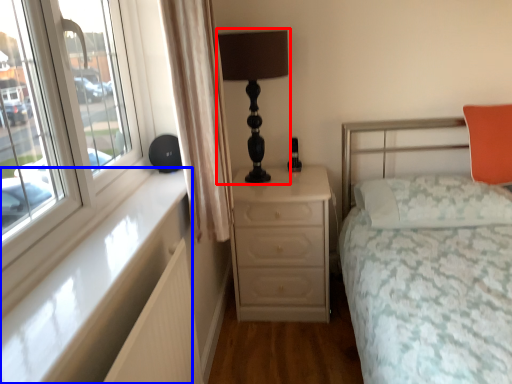
Question: Which object appears closest to the camera in this image, table lamp (highlighted by a red box) or window sill (highlighted by a blue box)?

Choices:
 (A) table lamp
 (B) window sill

Answer: (B)